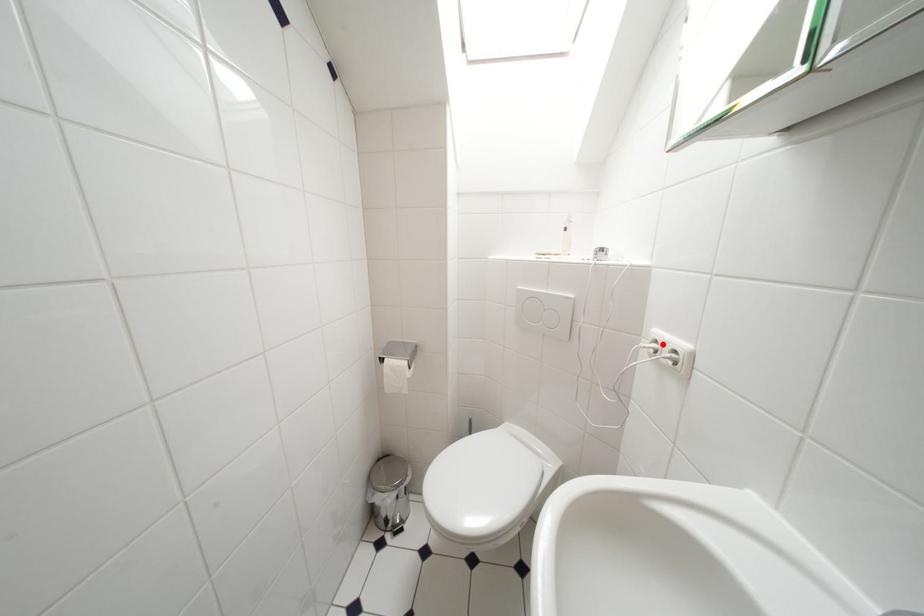
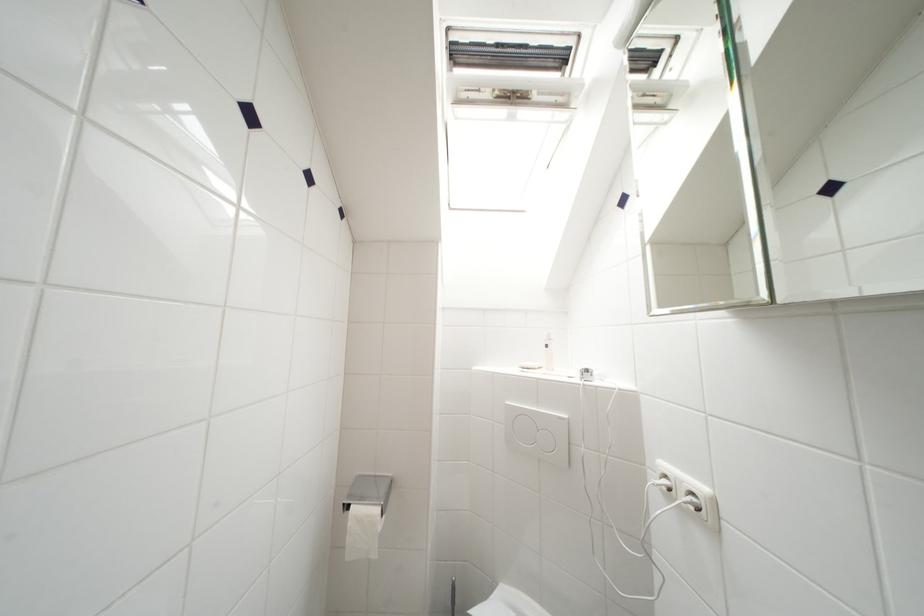
Locate, in the second image, the point that corresponds to the highlighted location in the first image.

(672, 480)